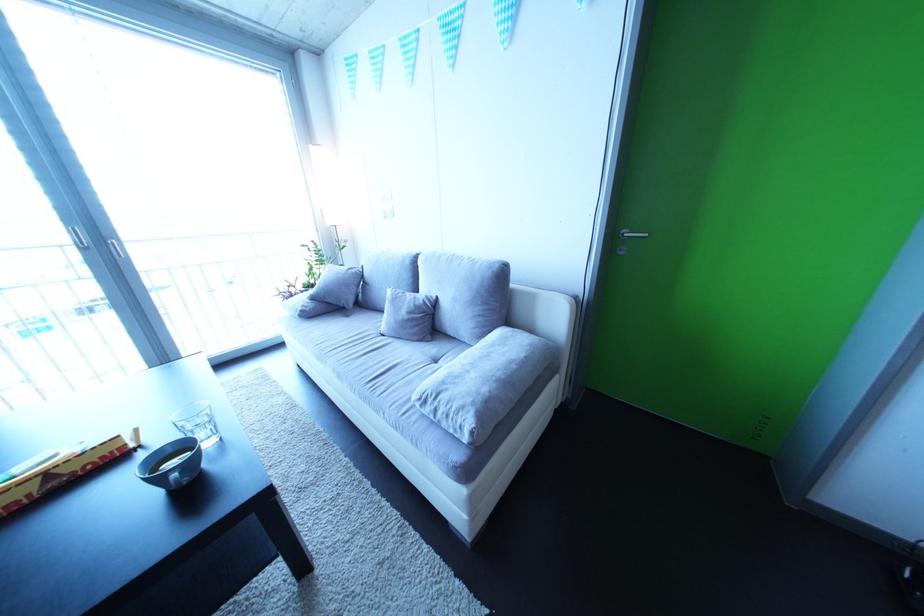
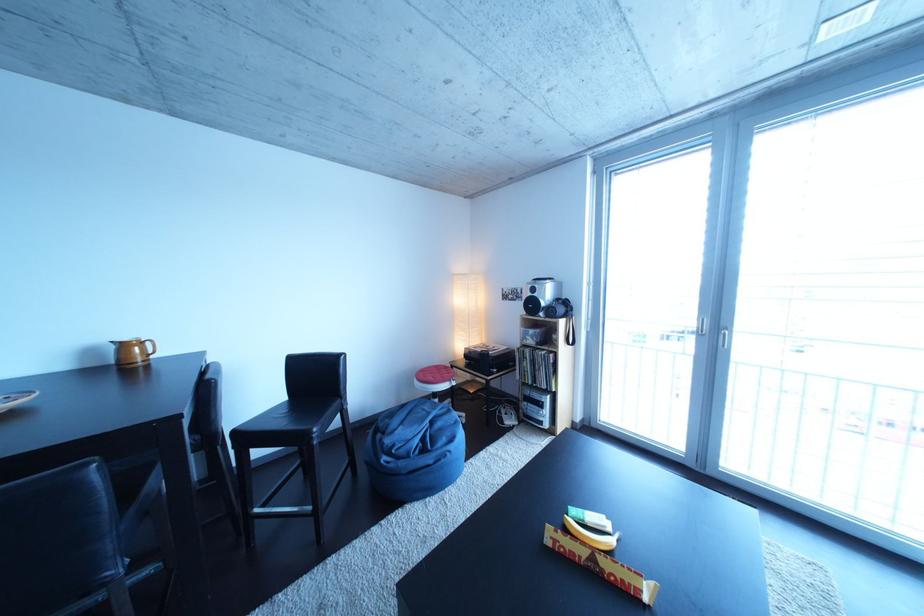
Find the pixel in the second image that matches point 84,474 in the first image.

(617, 570)